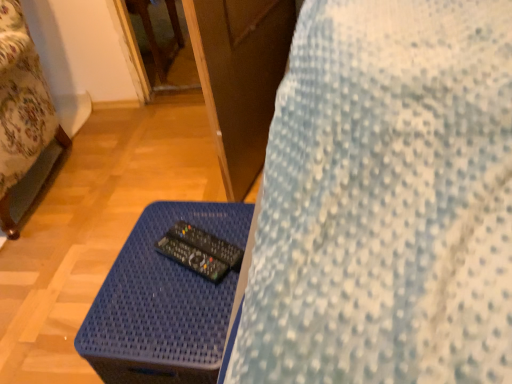
Question: Does black plastic remote at center, placed as the 1th control when sorted from bottom to top, have a smaller size compared to blue woven table at lower center?

Choices:
 (A) yes
 (B) no

Answer: (A)

Question: From a real-world perspective, is black plastic remote at center, placed as the 1th control when sorted from bottom to top, on blue woven table at lower center?

Choices:
 (A) no
 (B) yes

Answer: (B)

Question: Is black plastic remote at center, placed as the 1th control when sorted from bottom to top, to the left of blue woven table at lower center from the viewer's perspective?

Choices:
 (A) no
 (B) yes

Answer: (A)

Question: Considering the relative sizes of black plastic remote at center, arranged as the second control when viewed from the top, and blue woven table at lower center in the image provided, is black plastic remote at center, arranged as the second control when viewed from the top, shorter than blue woven table at lower center?

Choices:
 (A) yes
 (B) no

Answer: (A)

Question: Is blue woven table at lower center at the back of black plastic remote at center, arranged as the second control when viewed from the top?

Choices:
 (A) no
 (B) yes

Answer: (A)

Question: Is point (221, 240) closer or farther from the camera than point (19, 92)?

Choices:
 (A) closer
 (B) farther

Answer: (A)

Question: Considering the positions of black plastic remote at center, acting as the 2th control starting from the bottom, and wooden bed frame at left in the image, is black plastic remote at center, acting as the 2th control starting from the bottom, wider or thinner than wooden bed frame at left?

Choices:
 (A) wide
 (B) thin

Answer: (B)

Question: Visually, is black plastic remote at center, which is the 1th control in top-to-bottom order, positioned to the left or to the right of wooden bed frame at left?

Choices:
 (A) left
 (B) right

Answer: (B)

Question: From a real-world perspective, is black plastic remote at center, acting as the 2th control starting from the bottom, above or below wooden bed frame at left?

Choices:
 (A) above
 (B) below

Answer: (B)

Question: Is black plastic remote at center, which is the 1th control in top-to-bottom order, taller or shorter than blue woven table at lower center?

Choices:
 (A) short
 (B) tall

Answer: (A)

Question: Is black plastic remote at center, acting as the 2th control starting from the bottom, bigger or smaller than blue woven table at lower center?

Choices:
 (A) small
 (B) big

Answer: (A)

Question: Considering the relative positions of black plastic remote at center, acting as the 2th control starting from the bottom, and blue woven table at lower center in the image provided, is black plastic remote at center, acting as the 2th control starting from the bottom, to the left or to the right of blue woven table at lower center?

Choices:
 (A) left
 (B) right

Answer: (B)

Question: Considering the positions of black plastic remote at center, which is the 1th control in top-to-bottom order, and blue woven table at lower center in the image, is black plastic remote at center, which is the 1th control in top-to-bottom order, wider or thinner than blue woven table at lower center?

Choices:
 (A) thin
 (B) wide

Answer: (A)

Question: Relative to black plastic remote at center, arranged as the second control when viewed from the top, is blue woven table at lower center in front or behind?

Choices:
 (A) behind
 (B) front

Answer: (B)

Question: Is blue woven table at lower center inside the boundaries of black plastic remote at center, arranged as the second control when viewed from the top, or outside?

Choices:
 (A) inside
 (B) outside

Answer: (B)